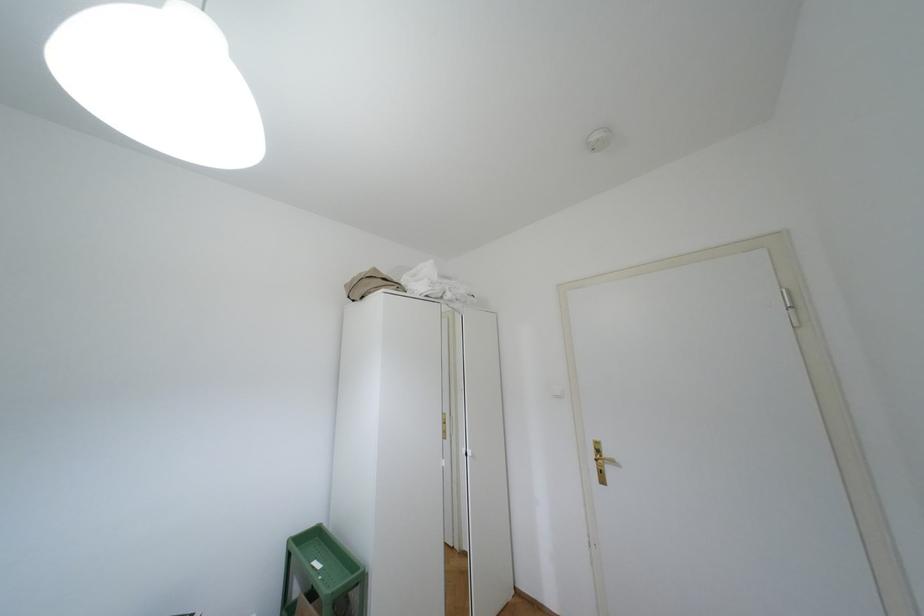
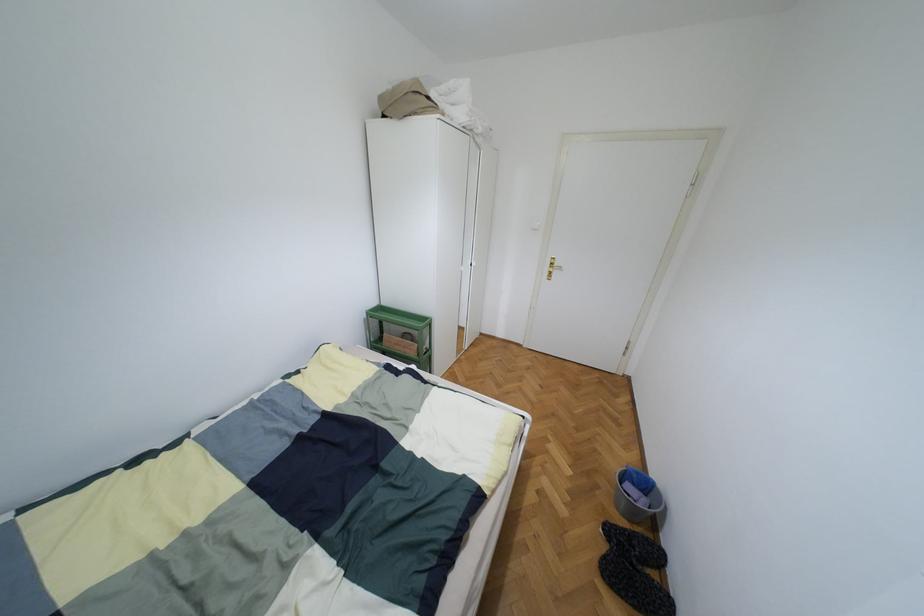
How did the camera likely rotate?

The rotation direction of the camera is right-down.